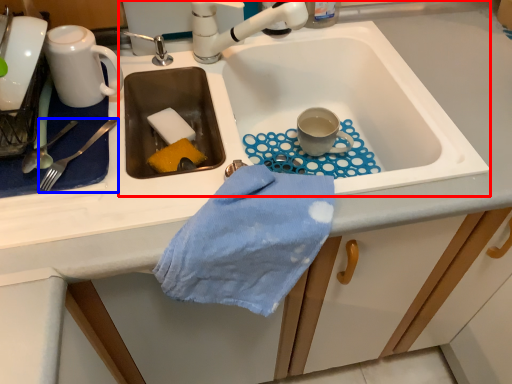
Question: Which object appears farthest to the camera in this image, sink (highlighted by a red box) or silverware (highlighted by a blue box)?

Choices:
 (A) sink
 (B) silverware

Answer: (A)